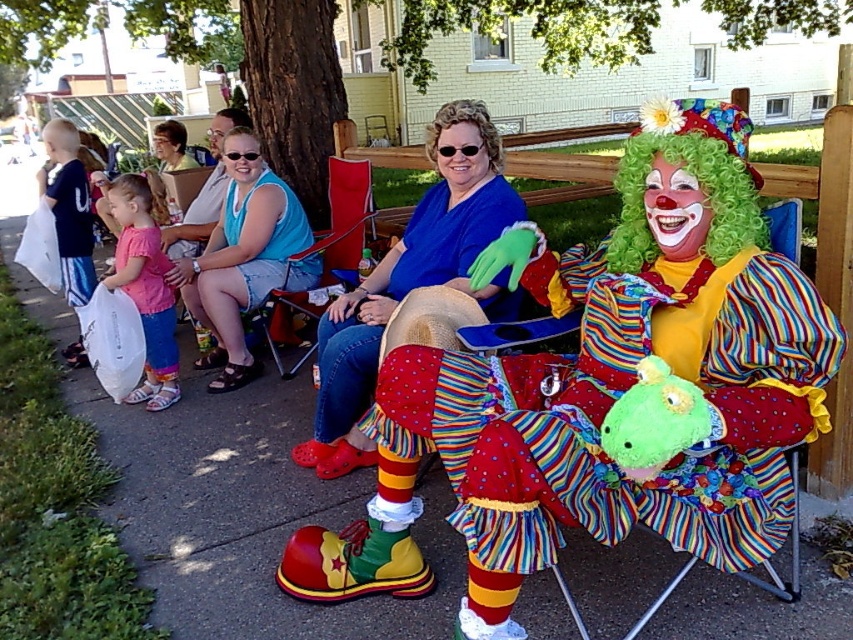
Where is the multicolored striped clown at center located in the image?

The multicolored striped clown at center is located at point coordinates of (602,390).

What is located at the coordinates point [247,253] in the image?

The point [247,253] indicates blue denim shorts at center.

What are the coordinates of the blue denim shorts at center?

The blue denim shorts at center are located at coordinates point (247, 253).